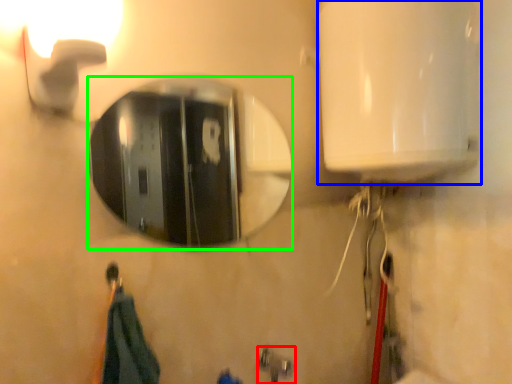
Question: Based on their relative distances, which object is farther from plumbing fixture (highlighted by a red box)? Choose from appliance (highlighted by a blue box) and mirror (highlighted by a green box).

Choices:
 (A) appliance
 (B) mirror

Answer: (B)